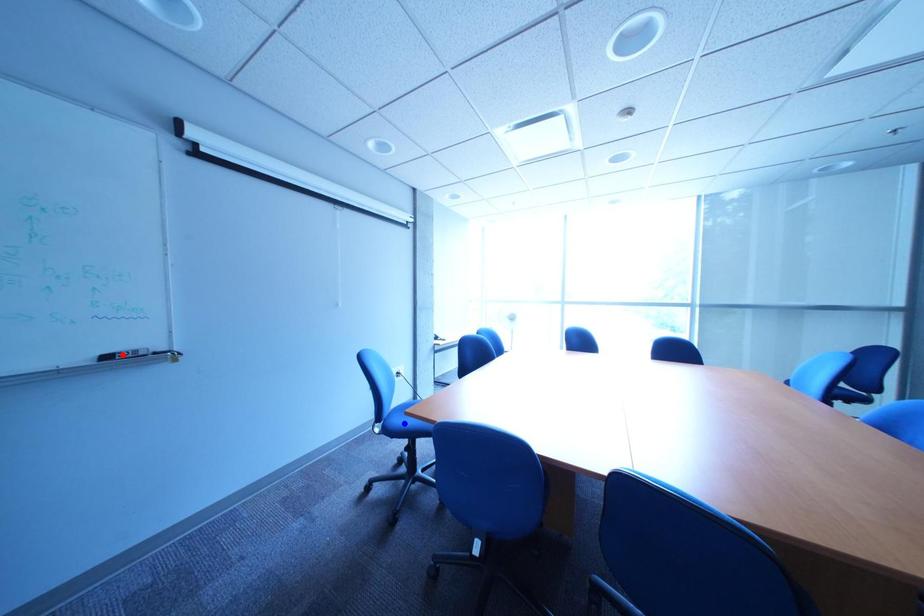
Question: Which of the two points in the image is closer to the camera?

Choices:
 (A) Blue point is closer.
 (B) Red point is closer.

Answer: (B)